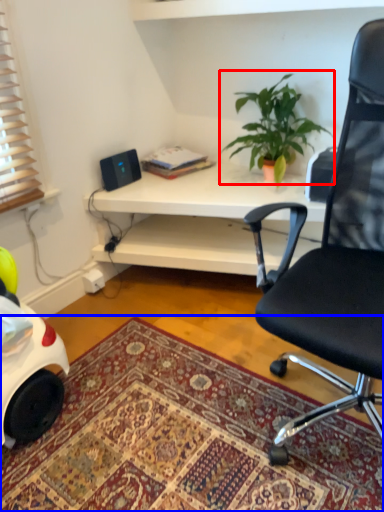
Question: Among these objects, which one is nearest to the camera, houseplant (highlighted by a red box) or mat (highlighted by a blue box)?

Choices:
 (A) houseplant
 (B) mat

Answer: (B)